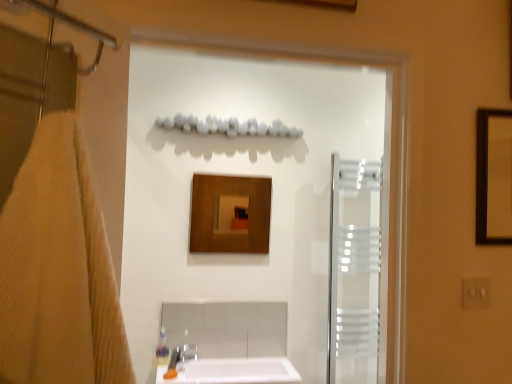
Question: From the image's perspective, does transparent glass screen door at center, the 1th screen door when ordered from front to back, appear lower than beige textured towel at left?

Choices:
 (A) yes
 (B) no

Answer: (B)

Question: Considering the relative positions of transparent glass screen door at center, acting as the first screen door starting from the left, and beige textured towel at left in the image provided, is transparent glass screen door at center, acting as the first screen door starting from the left, to the right of beige textured towel at left from the viewer's perspective?

Choices:
 (A) yes
 (B) no

Answer: (A)

Question: From a real-world perspective, is transparent glass screen door at center, placed as the 2th screen door when sorted from back to front, physically below beige textured towel at left?

Choices:
 (A) yes
 (B) no

Answer: (B)

Question: Can you confirm if transparent glass screen door at center, placed as the 2th screen door when sorted from back to front, is thinner than beige textured towel at left?

Choices:
 (A) no
 (B) yes

Answer: (B)

Question: From the image's perspective, is transparent glass screen door at center, which is the second screen door from right to left, above beige textured towel at left?

Choices:
 (A) no
 (B) yes

Answer: (B)

Question: Based on their positions, is white glossy sink at lower center located to the left or right of translucent frosted glass screen door at right, placed as the second screen door when sorted from left to right?

Choices:
 (A) left
 (B) right

Answer: (A)

Question: From a real-world perspective, relative to translucent frosted glass screen door at right, positioned as the first screen door in back-to-front order, is white glossy sink at lower center vertically above or below?

Choices:
 (A) below
 (B) above

Answer: (A)

Question: Considering the positions of white glossy sink at lower center and translucent frosted glass screen door at right, positioned as the first screen door in back-to-front order, in the image, is white glossy sink at lower center bigger or smaller than translucent frosted glass screen door at right, positioned as the first screen door in back-to-front order,?

Choices:
 (A) big
 (B) small

Answer: (B)

Question: Is point (159, 382) positioned closer to the camera than point (357, 230)?

Choices:
 (A) farther
 (B) closer

Answer: (B)

Question: From a real-world perspective, is translucent frosted glass screen door at right, positioned as the first screen door in back-to-front order, above or below beige textured towel at left?

Choices:
 (A) below
 (B) above

Answer: (A)

Question: Looking at their shapes, would you say translucent frosted glass screen door at right, which is the 1th screen door in right-to-left order, is wider or thinner than beige textured towel at left?

Choices:
 (A) wide
 (B) thin

Answer: (B)

Question: Is point (342, 211) closer or farther from the camera than point (121, 334)?

Choices:
 (A) closer
 (B) farther

Answer: (B)

Question: In terms of height, does translucent frosted glass screen door at right, which is the 1th screen door in right-to-left order, look taller or shorter compared to beige textured towel at left?

Choices:
 (A) short
 (B) tall

Answer: (B)

Question: Considering the positions of point (223, 233) and point (162, 269), is point (223, 233) closer or farther from the camera than point (162, 269)?

Choices:
 (A) farther
 (B) closer

Answer: (A)

Question: In terms of height, does wooden mirror at center look taller or shorter compared to transparent glass screen door at center, acting as the first screen door starting from the left?

Choices:
 (A) short
 (B) tall

Answer: (A)